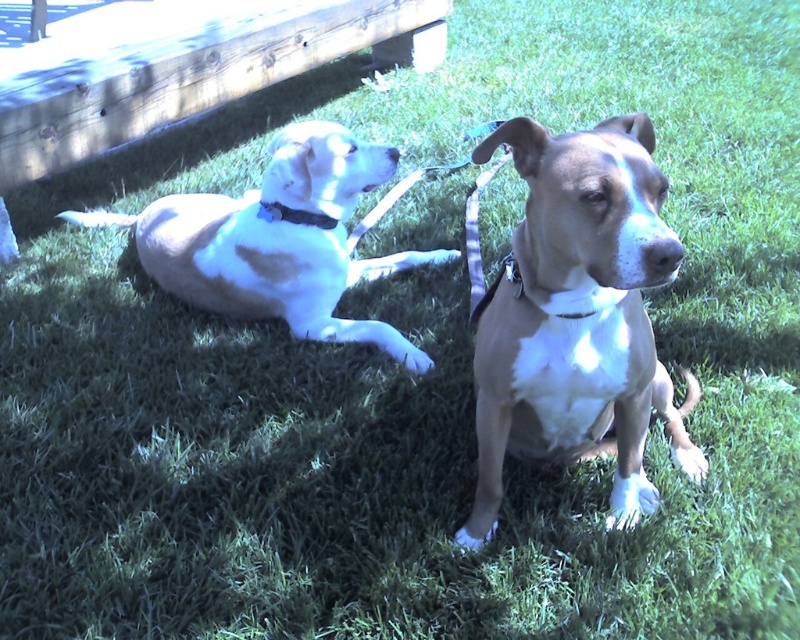
You are a photographer setting up a camera to capture both the light brown fur at left and the matte blue collar at upper left in the frame. Which object should you focus on first if you want to ensure both are in focus, considering their sizes?

The light brown fur at left is bigger than the matte blue collar at upper left, so you should focus on the light brown fur at left first to ensure both are in focus.

You are a dog owner who wants to put a matte blue collar at upper left on the brown matte dog at center. Can the collar fit around the dog?

The brown matte dog at center is taller than the matte blue collar at upper left, so the collar may not be large enough to fit around the dog.

In the scene shown: You are standing in the grassy area where the two dogs are located. You want to place a small water bowl exactly at the point marked as point [578,317]. Which dog is closer to this point?

The brown matte dog at center is located at point [578,317], so it is exactly at that point and thus the closest to the water bowl.